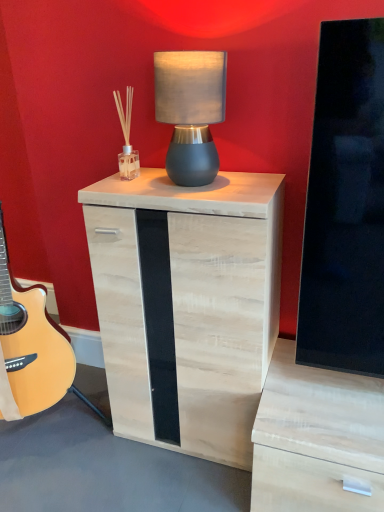
Image resolution: width=384 pixels, height=512 pixels. What are the coordinates of `vacant space in front of natural wood nightstand at center` in the screenshot? It's located at (177, 483).